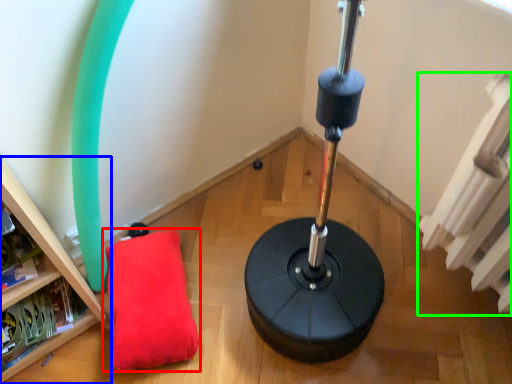
Question: Which is farther away from pillow (highlighted by a red box)? furniture (highlighted by a blue box) or radiator (highlighted by a green box)?

Choices:
 (A) furniture
 (B) radiator

Answer: (B)